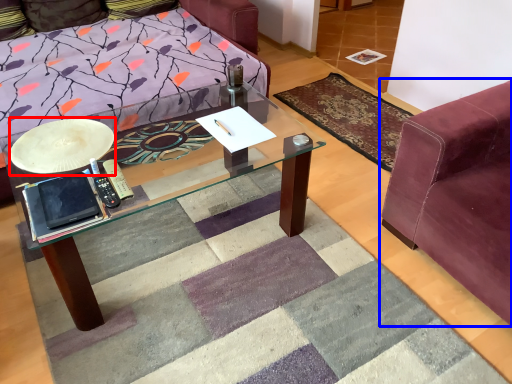
Question: Which object appears farthest to the camera in this image, round table (highlighted by a red box) or studio couch (highlighted by a blue box)?

Choices:
 (A) round table
 (B) studio couch

Answer: (A)